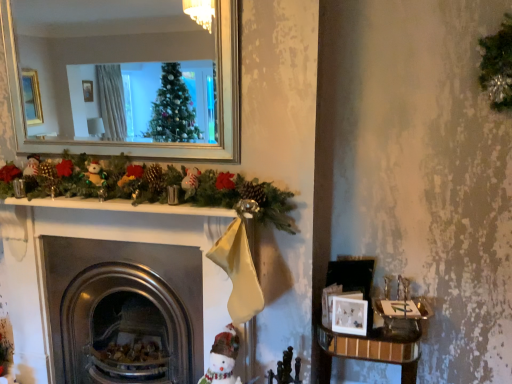
Question: Is metallic fireplace at center smaller than white matte picture frame at lower right?

Choices:
 (A) no
 (B) yes

Answer: (A)

Question: Does metallic fireplace at center have a lesser height compared to white matte picture frame at lower right?

Choices:
 (A) no
 (B) yes

Answer: (A)

Question: From the image's perspective, is metallic fireplace at center located beneath white matte picture frame at lower right?

Choices:
 (A) yes
 (B) no

Answer: (A)

Question: Would you say metallic fireplace at center contains white matte picture frame at lower right?

Choices:
 (A) no
 (B) yes

Answer: (A)

Question: Is metallic fireplace at center looking in the opposite direction of white matte picture frame at lower right?

Choices:
 (A) no
 (B) yes

Answer: (A)

Question: Is metallic fireplace at center directly adjacent to white matte picture frame at lower right?

Choices:
 (A) no
 (B) yes

Answer: (A)

Question: Does wooden table at lower right have a smaller size compared to white fabric snowman at lower center?

Choices:
 (A) yes
 (B) no

Answer: (B)

Question: From the image's perspective, is wooden table at lower right on top of white fabric snowman at lower center?

Choices:
 (A) no
 (B) yes

Answer: (A)

Question: Is wooden table at lower right located outside white fabric snowman at lower center?

Choices:
 (A) no
 (B) yes

Answer: (B)

Question: From a real-world perspective, is wooden table at lower right beneath white fabric snowman at lower center?

Choices:
 (A) yes
 (B) no

Answer: (A)

Question: Is wooden table at lower right at the right side of white fabric snowman at lower center?

Choices:
 (A) no
 (B) yes

Answer: (B)

Question: Is wooden table at lower right far away from white fabric snowman at lower center?

Choices:
 (A) no
 (B) yes

Answer: (A)

Question: Considering the relative sizes of metallic fireplace at center and white fabric snowman at lower center in the image provided, is metallic fireplace at center shorter than white fabric snowman at lower center?

Choices:
 (A) yes
 (B) no

Answer: (B)